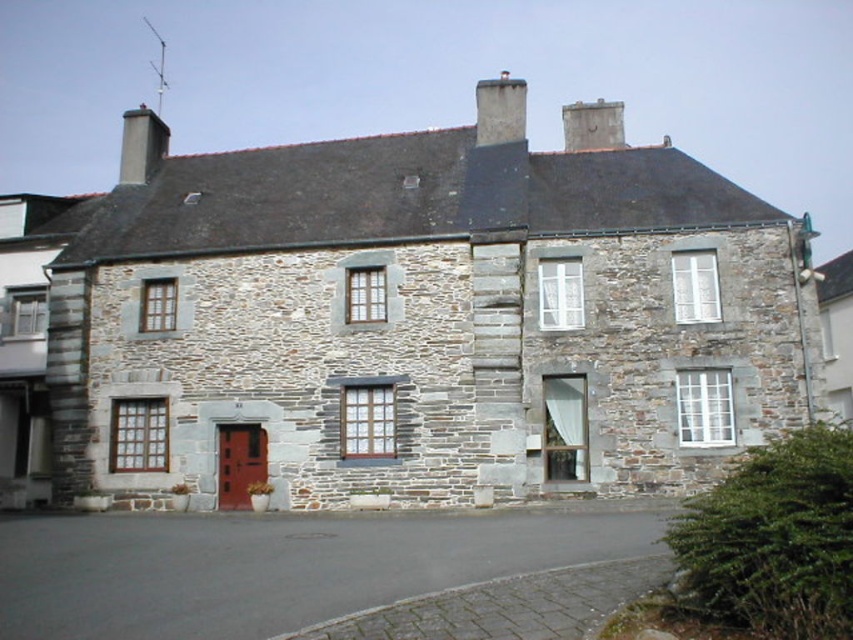
You are standing in front of the traditional stone house and notice two points marked on the facade. The first point is at coordinates point (x=509, y=97) and the second is at point (x=589, y=106). Which of these points is nearer to your current position?

Point (x=509, y=97) is closer to the camera than point (x=589, y=106), so the first point is nearer to your current position.

You are standing in front of the traditional stone house and want to enter through the smooth wooden door at center. Which side of the smooth gray chimney at upper left is the door located?

The smooth wooden door at center is located to the right of the smooth gray chimney at upper left.

You are standing in front of the traditional stone house and want to determine which chimney is closer to you. Which one is closer between the smooth gray chimney at upper left and the smooth stone chimney at upper center?

The smooth gray chimney at upper left is closer to you because it is further to the viewer than the smooth stone chimney at upper center.